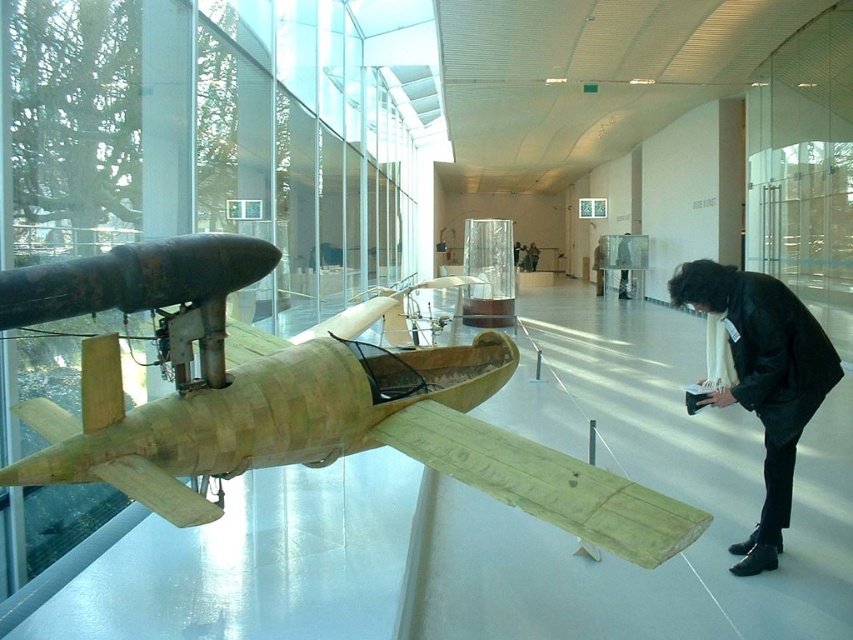
Question: Does wooden airplane at left have a larger size compared to black leather jacket at lower right?

Choices:
 (A) no
 (B) yes

Answer: (B)

Question: Can you confirm if wooden airplane at left is positioned above black leather jacket at lower right?

Choices:
 (A) no
 (B) yes

Answer: (B)

Question: Which point is farther to the camera?

Choices:
 (A) wooden airplane at left
 (B) black leather jacket at lower right

Answer: (B)

Question: Which point appears closest to the camera in this image?

Choices:
 (A) (776, 506)
 (B) (122, 454)

Answer: (B)

Question: Can you confirm if wooden airplane at left is positioned below black leather jacket at lower right?

Choices:
 (A) no
 (B) yes

Answer: (A)